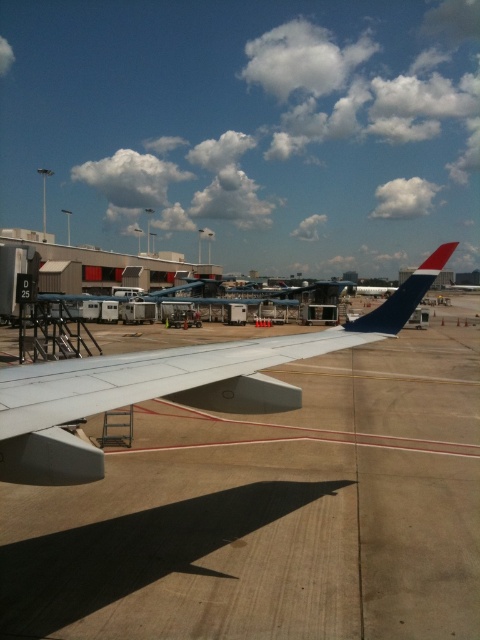
Between concrete tarmac at center and matte white wing at center, which one appears on the right side from the viewer's perspective?

Positioned to the right is concrete tarmac at center.

Between concrete tarmac at center and matte white wing at center, which one has more height?

concrete tarmac at center

The image size is (480, 640). What are the coordinates of `concrete tarmac at center` in the screenshot? It's located at (272, 513).

Locate an element on the screen. The width and height of the screenshot is (480, 640). concrete tarmac at center is located at coordinates (272, 513).

Can you confirm if matte white wing at center is taller than blue matte tail fin at upper right?

In fact, matte white wing at center may be shorter than blue matte tail fin at upper right.

Find the location of a particular element. The width and height of the screenshot is (480, 640). matte white wing at center is located at coordinates (168, 385).

Identify the location of matte white wing at center. This screenshot has width=480, height=640. (168, 385).

In order to click on matte white wing at center in this screenshot , I will do `click(168, 385)`.

Which is behind, point (445, 406) or point (422, 272)?

Point (445, 406)

Is concrete tarmac at center smaller than blue matte tail fin at upper right?

Actually, concrete tarmac at center might be larger than blue matte tail fin at upper right.

Between point (298, 612) and point (416, 284), which one is positioned behind?

The point (416, 284) is more distant.

What are the coordinates of `concrete tarmac at center` in the screenshot? It's located at (272, 513).